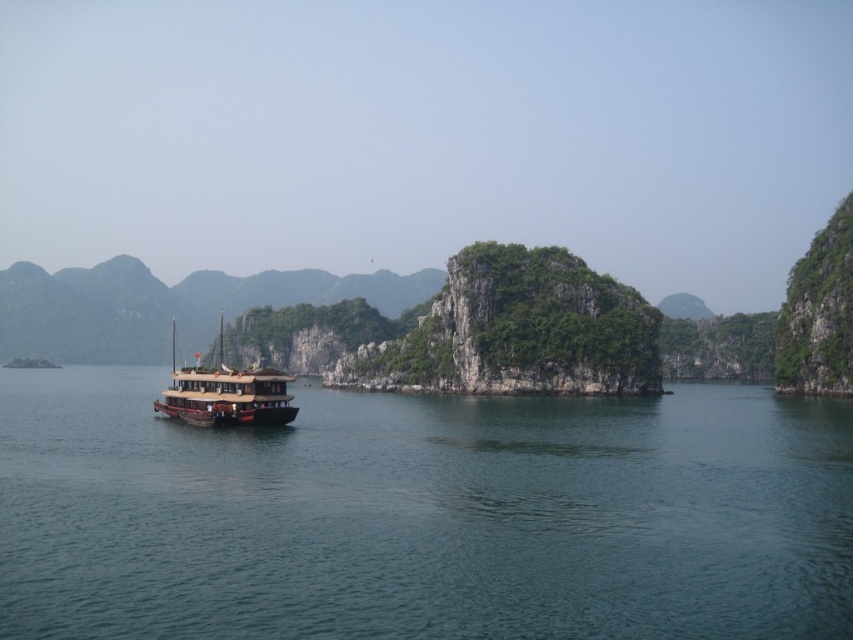
You are a tourist on a wooden boat at center and want to take a photo of the green water at lower left. Which direction should you face to capture it in your shot?

The green water at lower left is positioned on the right side of the wooden boat at center, so you should face to your right to capture it in your shot.

You are a tourist standing on the wooden boat at center and want to take a photo of the green water at lower left. In which direction should you point your camera relative to the boat?

The green water at lower left is located below the wooden boat at center, so you should point your camera downward from the wooden boat at center to capture the green water at lower left.

You are standing on the wooden boat at center and looking towards the green water at lower left. Which object is closer to the horizon?

The wooden boat at center is closer to the horizon than the green water at lower left because the green water at lower left is shorter than wooden boat at center.